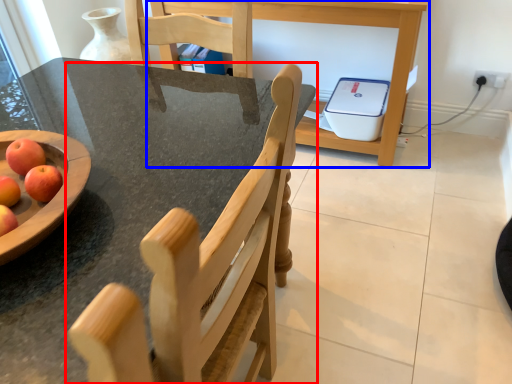
Question: Which of the following is the closest to the observer, chair (highlighted by a red box) or table (highlighted by a blue box)?

Choices:
 (A) chair
 (B) table

Answer: (A)